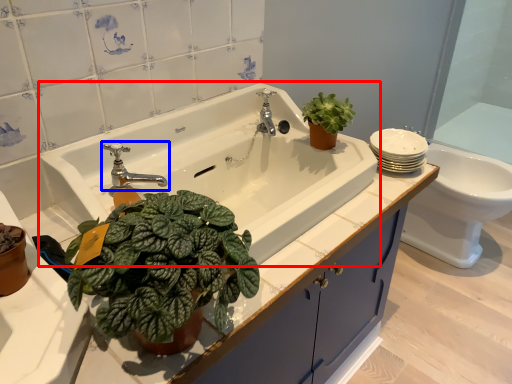
Question: Which point is closer to the camera, sink (highlighted by a red box) or tap (highlighted by a blue box)?

Choices:
 (A) sink
 (B) tap

Answer: (A)